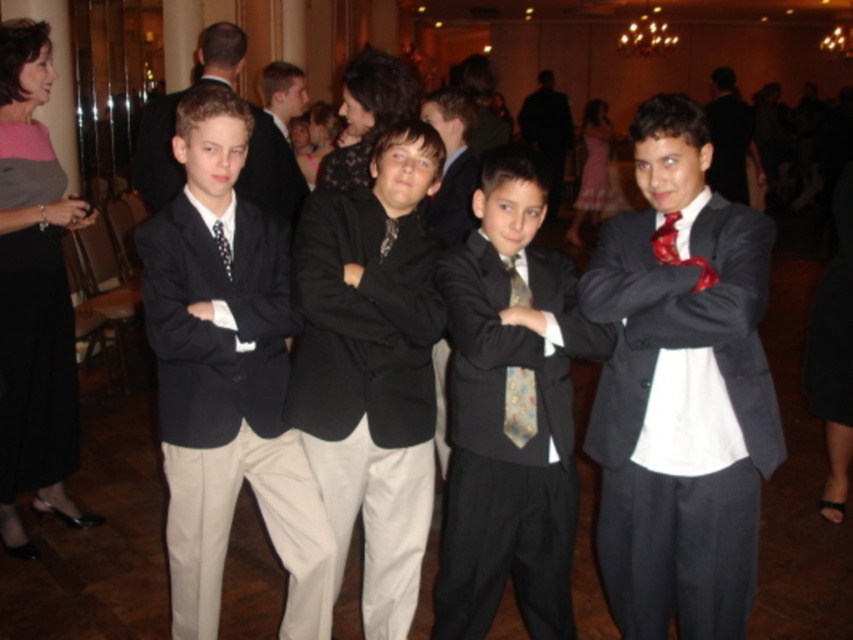
Between point (697, 524) and point (558, 182), which one is positioned behind?

The point (558, 182) is behind.

Is dark gray suit at right further to the viewer compared to matte black suit at center?

No, it is in front of matte black suit at center.

Who is more forward, (x=625, y=381) or (x=537, y=104)?

Point (x=625, y=381) is in front.

Identify the location of dark gray suit at right. The height and width of the screenshot is (640, 853). (682, 413).

Who is positioned more to the left, matte black suit at upper right or matte black suit at center?

matte black suit at center

Which is more to the right, matte black suit at upper right or matte black suit at center?

Positioned to the right is matte black suit at upper right.

Does point (740, 138) lie behind point (554, 209)?

That is False.

Find the location of a particular element. matte black suit at upper right is located at coordinates (730, 138).

What do you see at coordinates (509, 410) in the screenshot?
I see `shiny black suit at center` at bounding box center [509, 410].

Is point (450, 358) positioned in front of point (511, 392)?

No, it is not.

Where is `shiny black suit at center`? This screenshot has height=640, width=853. shiny black suit at center is located at coordinates (509, 410).